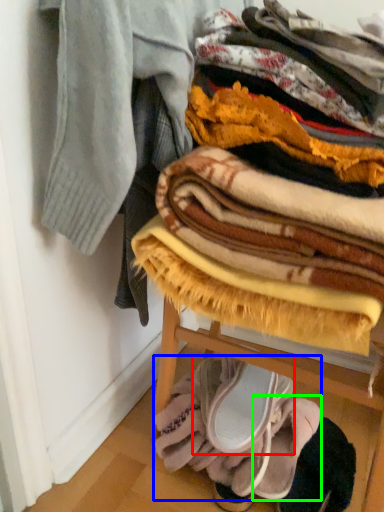
Question: Which object is the farthest from footwear (highlighted by a red box)? Choose among these: blanket (highlighted by a blue box) or footwear (highlighted by a green box).

Choices:
 (A) blanket
 (B) footwear

Answer: (B)